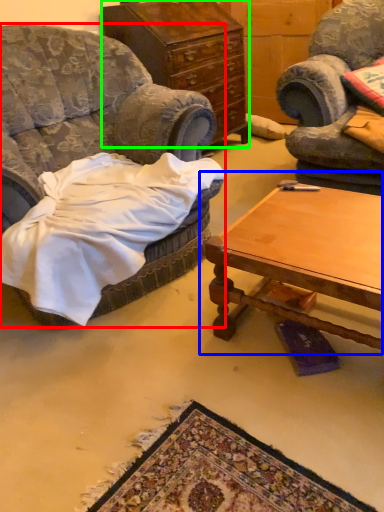
Question: Considering the real-world distances, which object is farthest from chair (highlighted by a red box)? coffee table (highlighted by a blue box) or cabinetry (highlighted by a green box)?

Choices:
 (A) coffee table
 (B) cabinetry

Answer: (B)